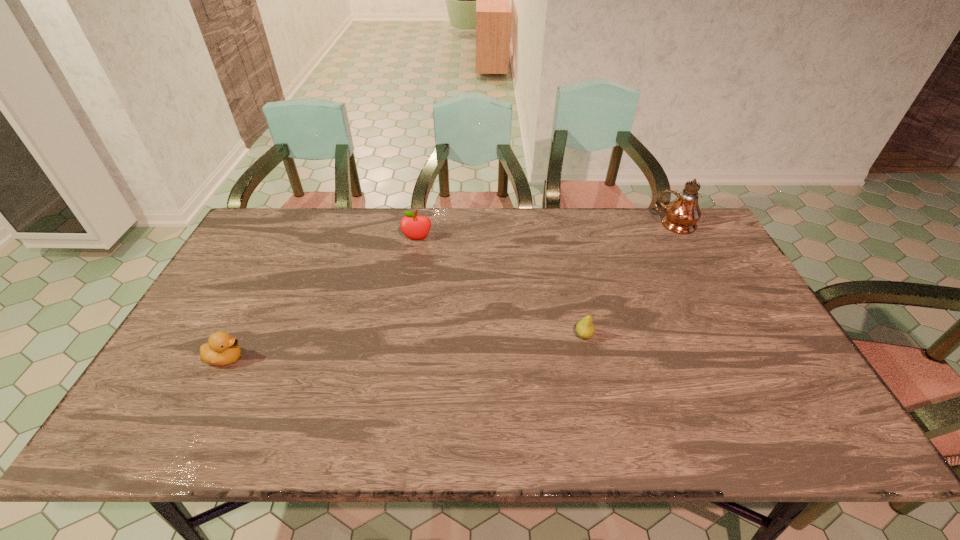
Where is `vacant area between the second nearest object and the rightmost object`? vacant area between the second nearest object and the rightmost object is located at coordinates (630, 280).

In order to click on blank region between the nearest object and the oil lamp in this screenshot , I will do `click(450, 291)`.

The image size is (960, 540). What are the coordinates of `free point between the second object from right to left and the third nearest object` in the screenshot? It's located at (500, 287).

I want to click on the closest object to the second object from left to right, so tap(222, 349).

This screenshot has width=960, height=540. I want to click on object that stands as the second closest to the rightmost object, so click(413, 226).

Locate an element on the screen. This screenshot has width=960, height=540. free spot that satisfies the following two spatial constraints: 1. on the back side of the oil lamp; 2. on the right side of the apple is located at coordinates (420, 225).

Locate an element on the screen. The height and width of the screenshot is (540, 960). free space in the image that satisfies the following two spatial constraints: 1. on the front side of the rightmost object; 2. facing forward on the duckling is located at coordinates (747, 358).

This screenshot has width=960, height=540. Find the location of `free space that satisfies the following two spatial constraints: 1. on the back side of the tallest object; 2. on the right side of the third object from left to right`. free space that satisfies the following two spatial constraints: 1. on the back side of the tallest object; 2. on the right side of the third object from left to right is located at coordinates (560, 225).